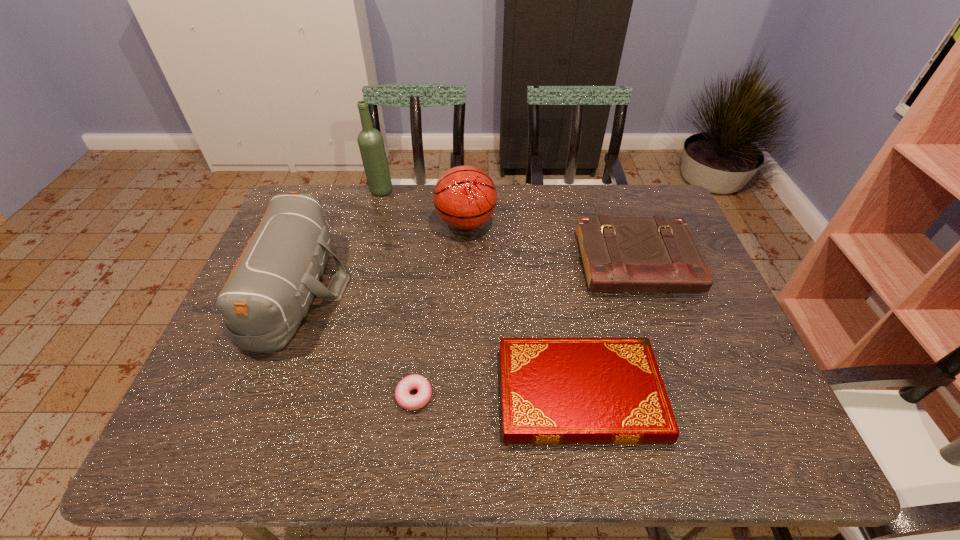
The image size is (960, 540). In order to click on free space that satisfies the following two spatial constraints: 1. on the side with spill of the basketball; 2. on the right side of the farther hardback book in this screenshot , I will do `click(465, 262)`.

Find the location of a particular element. The height and width of the screenshot is (540, 960). vacant space that satisfies the following two spatial constraints: 1. on the front side of the fourth tallest object; 2. on the left side of the wine bottle is located at coordinates (362, 262).